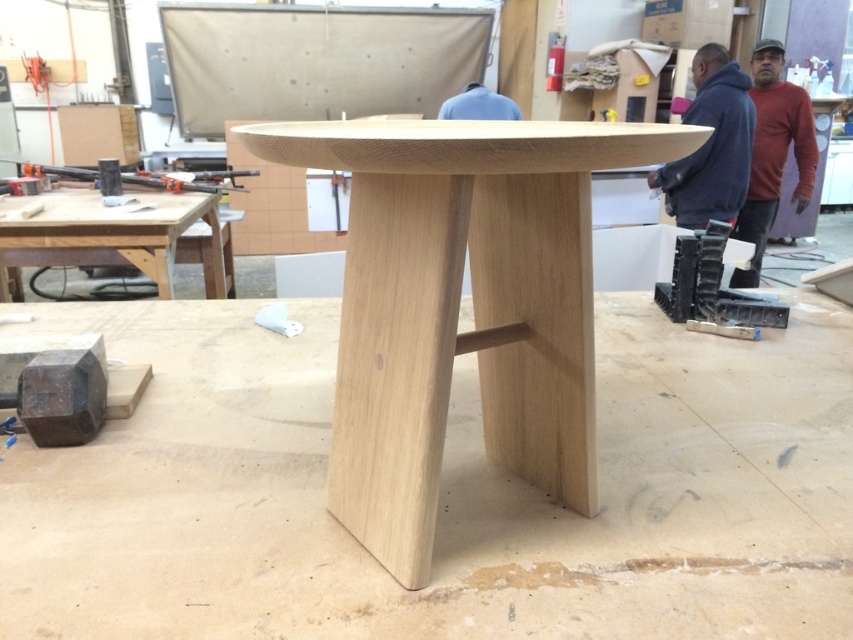
Between natural wood table at center and natural wood table at left, which one appears on the left side from the viewer's perspective?

Positioned to the left is natural wood table at left.

Does point (544, 186) come behind point (85, 237)?

No.

You are a GUI agent. You are given a task and a screenshot of the screen. Output one action in this format:
    pyautogui.click(x=<x>, y=<y>)
    Task: Click on the natural wood table at center
    
    Given the screenshot: What is the action you would take?
    pyautogui.click(x=457, y=305)